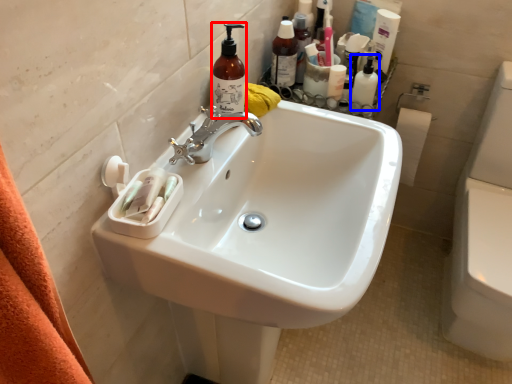
Question: Which object is further to the camera taking this photo, cleaning product (highlighted by a red box) or toiletry (highlighted by a blue box)?

Choices:
 (A) cleaning product
 (B) toiletry

Answer: (B)